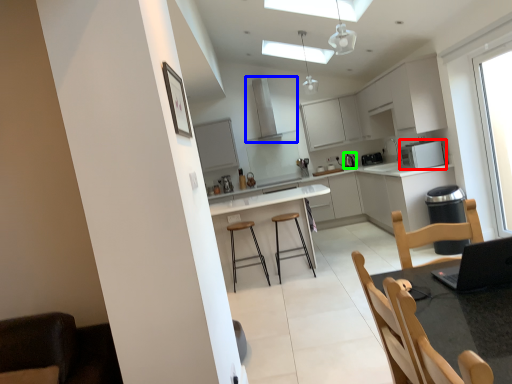
Question: Estimate the real-world distances between objects in this image. Which object is closer to appliance (highlighted by a red box), exhaust hood (highlighted by a blue box) or appliance (highlighted by a green box)?

Choices:
 (A) exhaust hood
 (B) appliance

Answer: (B)